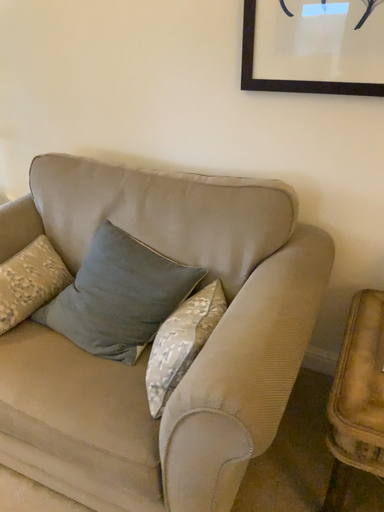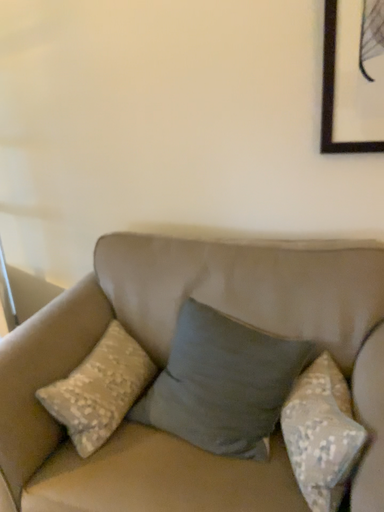
Question: Which way did the camera rotate in the video?

Choices:
 (A) rotated downward
 (B) rotated upward

Answer: (B)